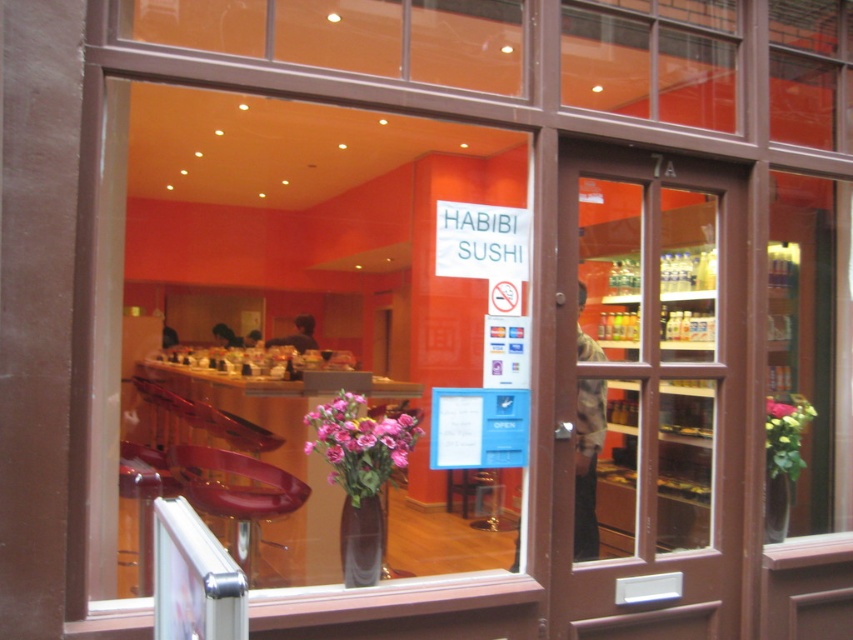
Between brown wooden door at center and pink matte vase at lower right, which one appears on the right side from the viewer's perspective?

Positioned to the right is pink matte vase at lower right.

Which is in front, point (682, 280) or point (775, 461)?

Positioned in front is point (775, 461).

At what (x,y) coordinates should I click in order to perform the action: click on brown wooden door at center. Please return your answer as a coordinate pair (x, y). Looking at the image, I should click on (653, 388).

Does point (364, 419) come closer to viewer compared to point (366, 538)?

No, it is behind (366, 538).

Is point (375, 454) positioned after point (357, 536)?

Yes, it is behind point (357, 536).

Which is in front, point (395, 424) or point (370, 554)?

Point (370, 554) is more forward.

Where is `pink matte vase at center`? Image resolution: width=853 pixels, height=640 pixels. pink matte vase at center is located at coordinates (360, 444).

Between brown wooden door at center and translucent glass vase at lower right, which one has more height?

Standing taller between the two is brown wooden door at center.

Can you confirm if brown wooden door at center is shorter than translucent glass vase at lower right?

No.

This screenshot has width=853, height=640. In order to click on brown wooden door at center in this screenshot , I will do `click(653, 388)`.

What are the coordinates of `brown wooden door at center` in the screenshot? It's located at (653, 388).